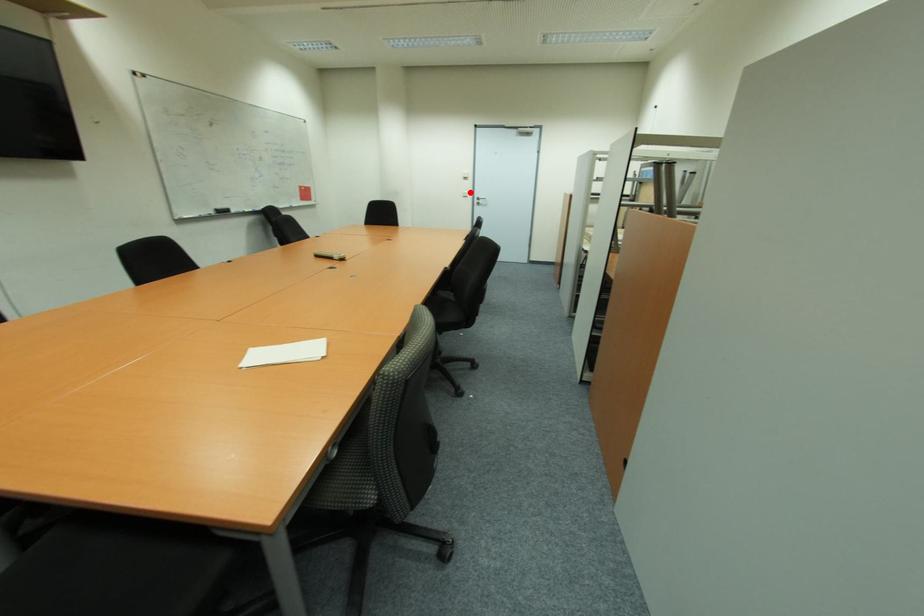
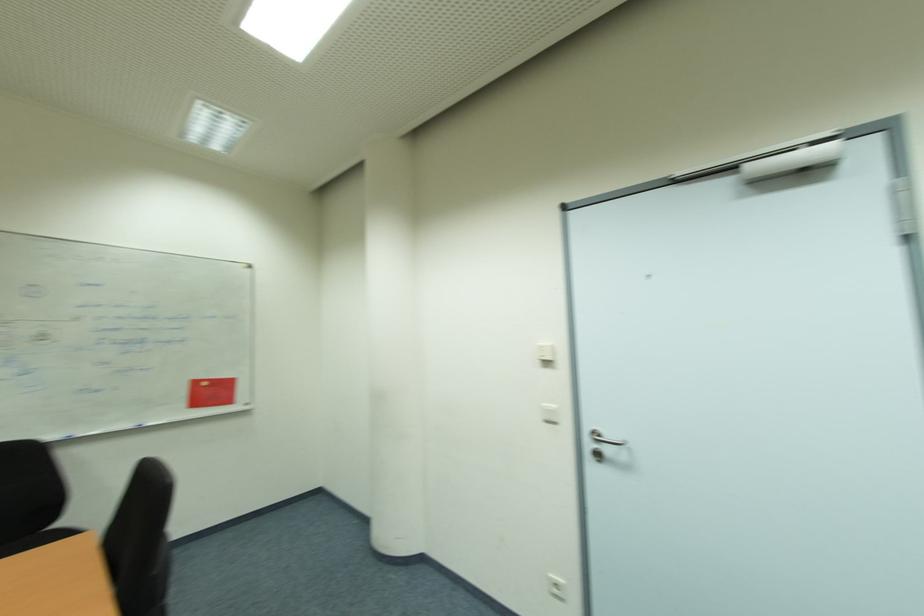
Question: I am providing you with two images of the same scene from different viewpoints. Image1 has a red point marked. In image2, the corresponding 3D location appears at what relative position? Reply with the corresponding letter.

Choices:
 (A) Closer
 (B) Farther

Answer: (B)